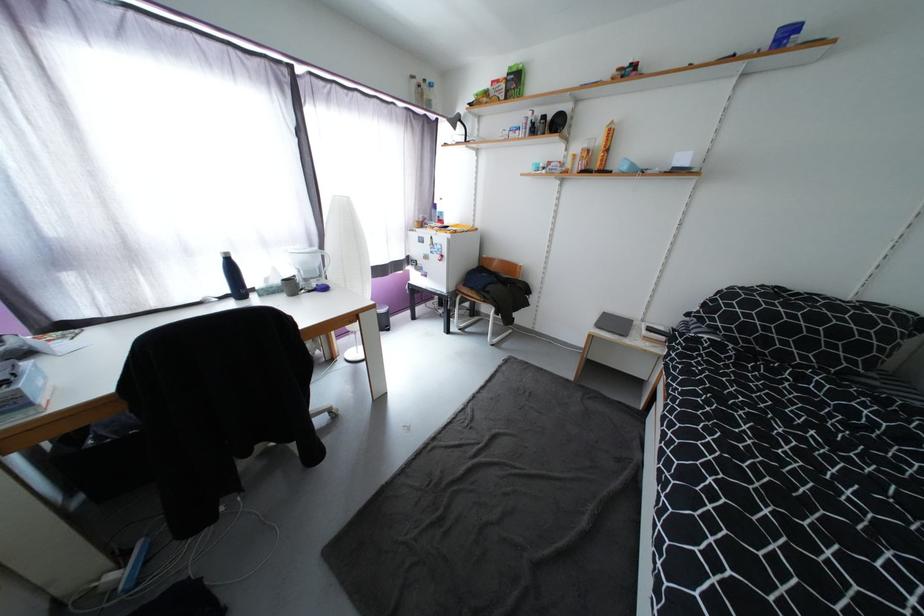
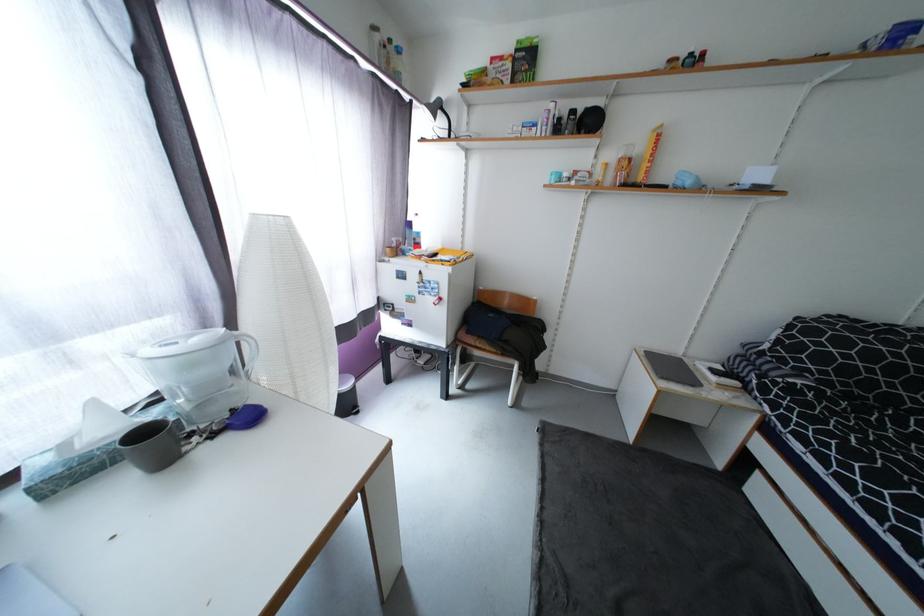
The point at (604, 143) is marked in the first image. Where is the corresponding point in the second image?

(647, 151)